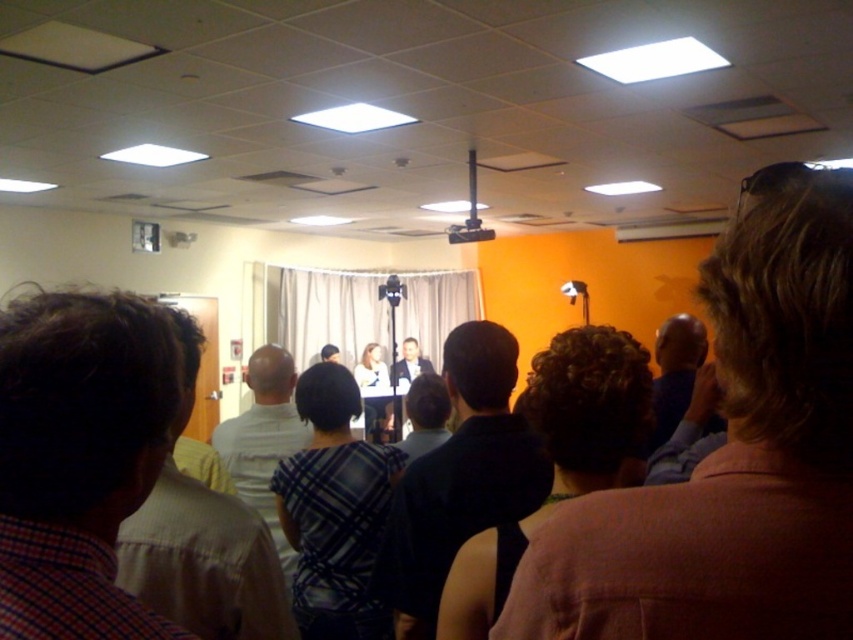
Can you confirm if dark brown hair at center is positioned to the left of plaid fabric shirt at center?

Incorrect, dark brown hair at center is not on the left side of plaid fabric shirt at center.

Is dark brown hair at center smaller than plaid fabric shirt at center?

No.

Between point (573, 442) and point (363, 550), which one is positioned in front?

Point (573, 442) is more forward.

Identify the location of dark brown hair at center. (558, 458).

Can you confirm if light brown hair at right is positioned above dark blue shirt at right?

Indeed, light brown hair at right is positioned over dark blue shirt at right.

Is light brown hair at right positioned behind dark blue shirt at right?

That is False.

Where is `light brown hair at right`? This screenshot has width=853, height=640. light brown hair at right is located at coordinates (730, 460).

Where is `light brown hair at right`? This screenshot has height=640, width=853. light brown hair at right is located at coordinates (730, 460).

Image resolution: width=853 pixels, height=640 pixels. Describe the element at coordinates (730, 460) in the screenshot. I see `light brown hair at right` at that location.

Is light brown hair at right smaller than plaid shirt at left?

Incorrect, light brown hair at right is not smaller in size than plaid shirt at left.

You are a GUI agent. You are given a task and a screenshot of the screen. Output one action in this format:
    pyautogui.click(x=<x>, y=<y>)
    Task: Click on the light brown hair at right
    
    Given the screenshot: What is the action you would take?
    pyautogui.click(x=730, y=460)